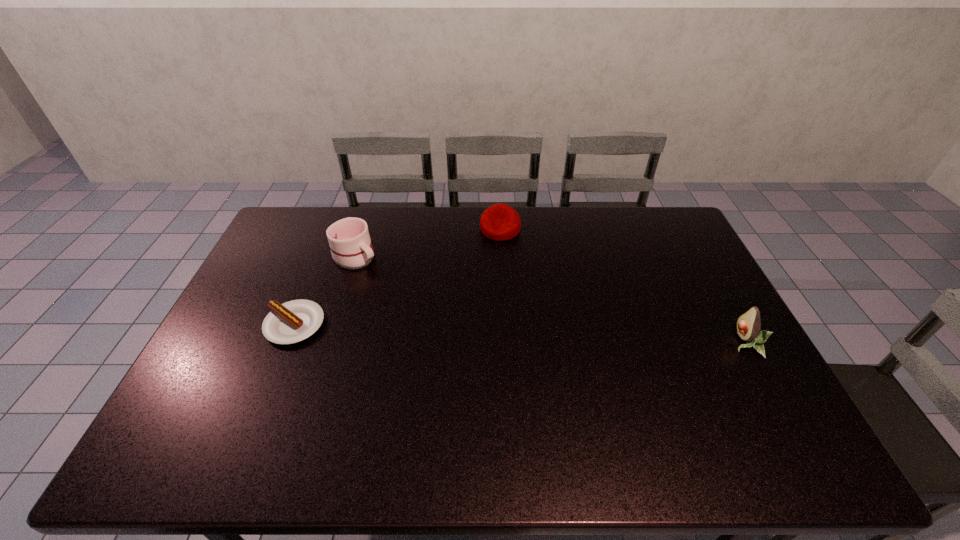
The height and width of the screenshot is (540, 960). Identify the location of free space between the mug and the rightmost object. (550, 300).

I want to click on blank region between the mug and the avocado, so 550,300.

At what (x,y) coordinates should I click in order to perform the action: click on free space between the shortest object and the avocado. Please return your answer as a coordinate pair (x, y). The width and height of the screenshot is (960, 540). Looking at the image, I should click on (520, 334).

Where is `free space between the shortest object and the second shortest object`? free space between the shortest object and the second shortest object is located at coordinates (397, 277).

Image resolution: width=960 pixels, height=540 pixels. Find the location of `the second closest object to the beanbag`. the second closest object to the beanbag is located at coordinates pyautogui.click(x=291, y=322).

Identify the location of the third closest object relative to the avocado. (291, 322).

Where is `free point that satisfies the following two spatial constraints: 1. on the front side of the avocado; 2. on the seed side of the mug`? Image resolution: width=960 pixels, height=540 pixels. free point that satisfies the following two spatial constraints: 1. on the front side of the avocado; 2. on the seed side of the mug is located at coordinates (327, 343).

At what (x,y) coordinates should I click in order to perform the action: click on vacant position in the image that satisfies the following two spatial constraints: 1. on the front side of the avocado; 2. on the seed side of the second object from right to left. Please return your answer as a coordinate pair (x, y). Looking at the image, I should click on (506, 343).

You are a GUI agent. You are given a task and a screenshot of the screen. Output one action in this format:
    pyautogui.click(x=<x>, y=<y>)
    Task: Click on the free space that satisfies the following two spatial constraints: 1. on the front side of the avocado; 2. on the seed side of the beanbag
    This screenshot has height=540, width=960.
    Given the screenshot: What is the action you would take?
    pyautogui.click(x=506, y=343)